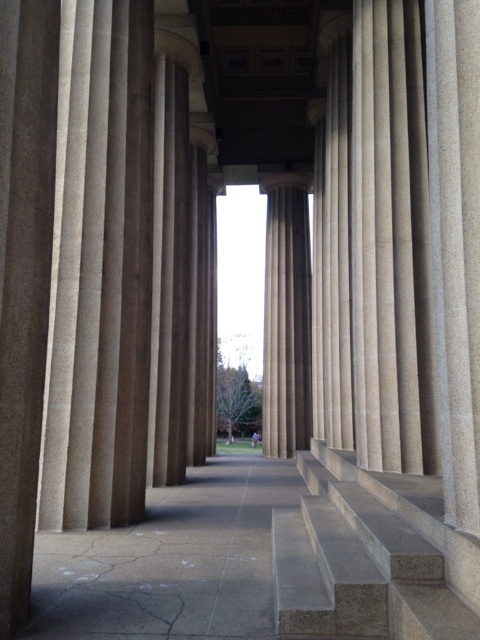
Question: Can you confirm if beige stone column at center is positioned to the left of sanded stone column at center?

Choices:
 (A) yes
 (B) no

Answer: (B)

Question: In this image, where is gray concrete pavement at center located relative to sanded stone column at center?

Choices:
 (A) left
 (B) right

Answer: (A)

Question: Which of the following is the closest to the observer?

Choices:
 (A) (450, 582)
 (B) (310, 392)

Answer: (A)

Question: Which of these objects is positioned farthest from the beige stone column at center?

Choices:
 (A) smooth concrete stairs at center
 (B) sanded stone column at center

Answer: (B)

Question: Among these points, which one is farthest from the camera?

Choices:
 (A) (408, 214)
 (B) (269, 397)
 (C) (191, 524)
 (D) (414, 563)

Answer: (B)

Question: Is gray concrete pavement at center thinner than beige stone column at center?

Choices:
 (A) no
 (B) yes

Answer: (B)